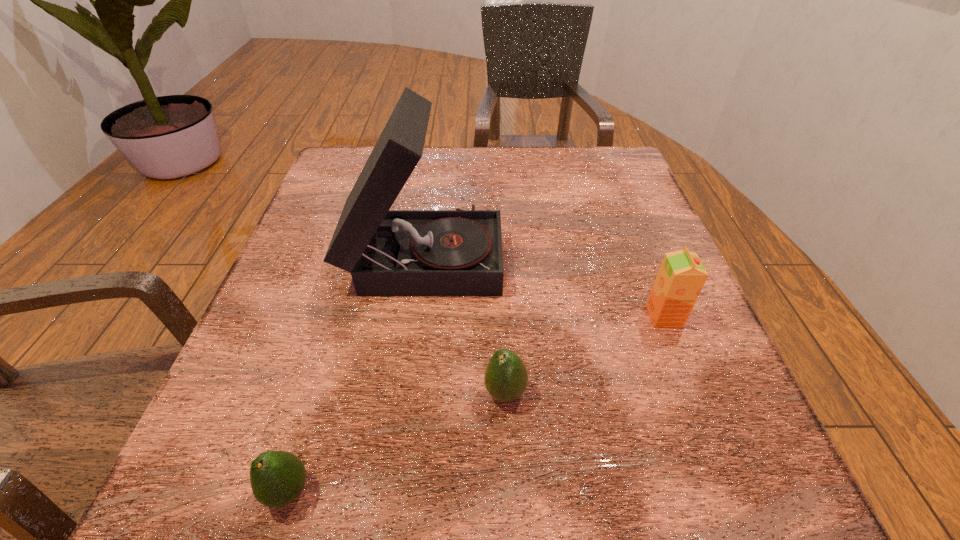
Locate an element on the screen. vacant region at the right edge of the desktop is located at coordinates (595, 232).

Identify the location of vacant space at the near left corner. This screenshot has height=540, width=960. (168, 512).

Image resolution: width=960 pixels, height=540 pixels. In the image, there is a desktop. In order to click on vacant space at the far right corner in this screenshot , I will do `click(620, 149)`.

Locate an element on the screen. The width and height of the screenshot is (960, 540). free space between the rightmost object and the farthest object is located at coordinates (544, 285).

Where is `empty space between the nearest object and the phonograph_record`? This screenshot has width=960, height=540. empty space between the nearest object and the phonograph_record is located at coordinates (356, 373).

Where is `free space between the nearer avocado and the phonograph_record`? The width and height of the screenshot is (960, 540). free space between the nearer avocado and the phonograph_record is located at coordinates (356, 373).

Where is `blank region between the nearest object and the second farthest object`? blank region between the nearest object and the second farthest object is located at coordinates (476, 404).

Where is `empty space that is in between the rightmost object and the nearest object`? The width and height of the screenshot is (960, 540). empty space that is in between the rightmost object and the nearest object is located at coordinates (476, 404).

Find the location of `free spot between the orange juice and the tallest object`. free spot between the orange juice and the tallest object is located at coordinates (544, 285).

In order to click on free space between the farthest object and the nearer avocado in this screenshot , I will do `click(356, 373)`.